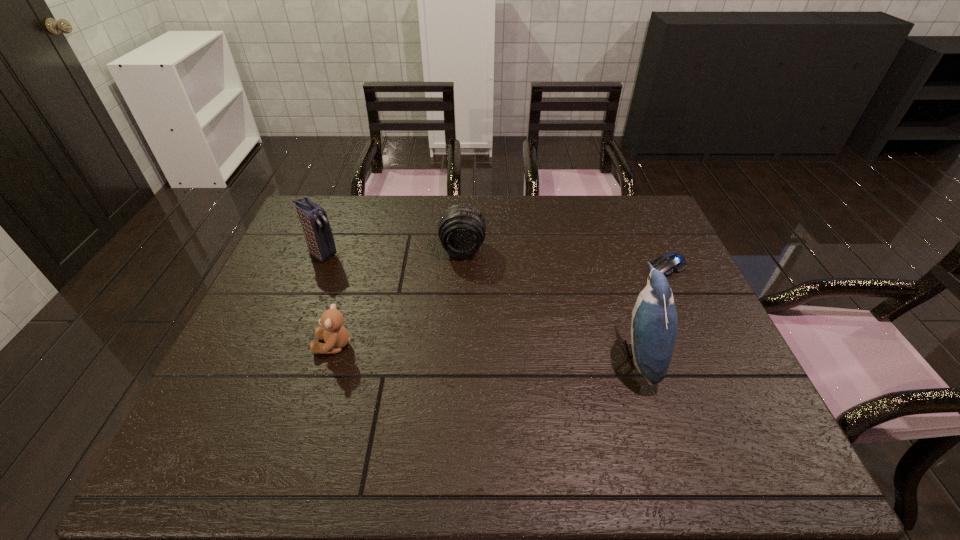
You are a GUI agent. You are given a task and a screenshot of the screen. Output one action in this format:
    pyautogui.click(x=<x>, y=<y>)
    Task: Click on the empty space that is in between the telephoto lens and the shortest object
    The image size is (960, 540).
    Given the screenshot: What is the action you would take?
    pyautogui.click(x=565, y=258)

You are a GUI agent. You are given a task and a screenshot of the screen. Output one action in this format:
    pyautogui.click(x=<x>, y=<y>)
    Task: Click on the object that can be found as the closest to the computer mouse
    This screenshot has width=960, height=540.
    Given the screenshot: What is the action you would take?
    tap(653, 331)

Identify which object is the fourth closest to the second shortest object. Please provide its 2D coordinates. Your answer should be formatted as a tuple, i.e. [(x, y)], where the tuple contains the x and y coordinates of a point satisfying the conditions above.

[(671, 263)]

You are a GUI agent. You are given a task and a screenshot of the screen. Output one action in this format:
    pyautogui.click(x=<x>, y=<y>)
    Task: Click on the vacant space that satisfies the following two spatial constraints: 1. on the front side of the fourth shortest object; 2. on the front-facing side of the teddy bear
    The width and height of the screenshot is (960, 540).
    Given the screenshot: What is the action you would take?
    pyautogui.click(x=286, y=345)

Identify the location of vacant space that satisfies the following two spatial constraints: 1. on the back side of the third object from right to left; 2. on the left side of the second tallest object. (324, 249).